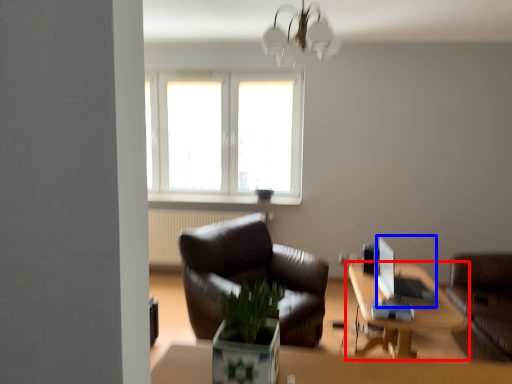
Question: Which object is closer to the camera taking this photo, table (highlighted by a red box) or computer (highlighted by a blue box)?

Choices:
 (A) table
 (B) computer

Answer: (A)